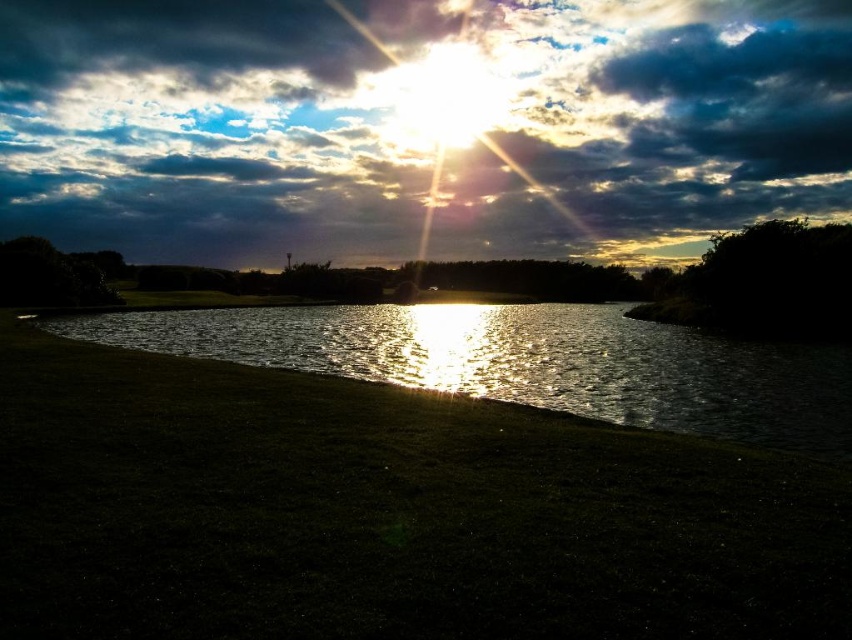
Question: Considering the relative positions of cloudy sky at upper center and glistening water at center in the image provided, where is cloudy sky at upper center located with respect to glistening water at center?

Choices:
 (A) left
 (B) right

Answer: (B)

Question: Can you confirm if cloudy sky at upper center is bigger than glistening water at center?

Choices:
 (A) yes
 (B) no

Answer: (A)

Question: Is cloudy sky at upper center behind glistening water at center?

Choices:
 (A) no
 (B) yes

Answer: (B)

Question: Which point is closer to the camera taking this photo?

Choices:
 (A) (255, 364)
 (B) (55, 124)

Answer: (A)

Question: Which point is farther from the camera taking this photo?

Choices:
 (A) (409, 221)
 (B) (210, 342)

Answer: (A)